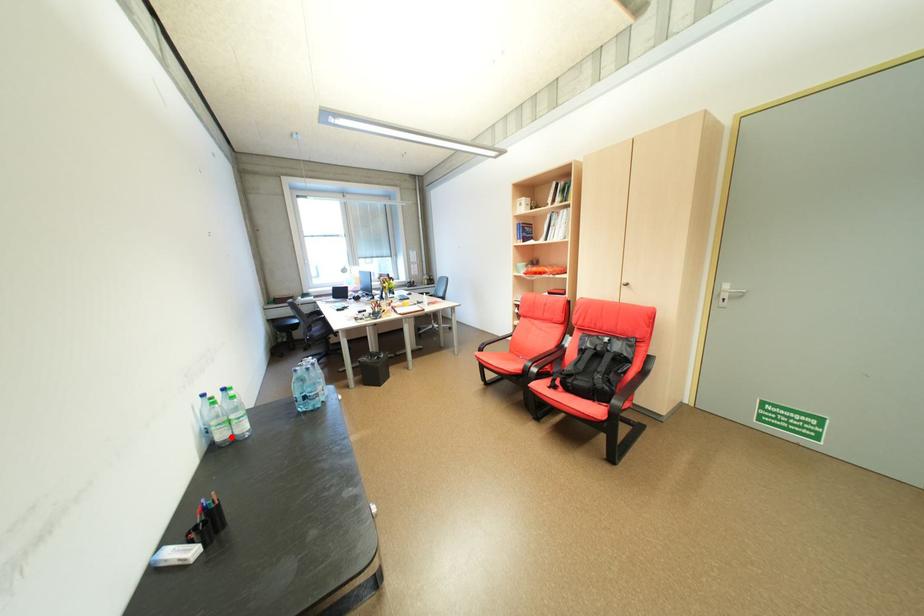
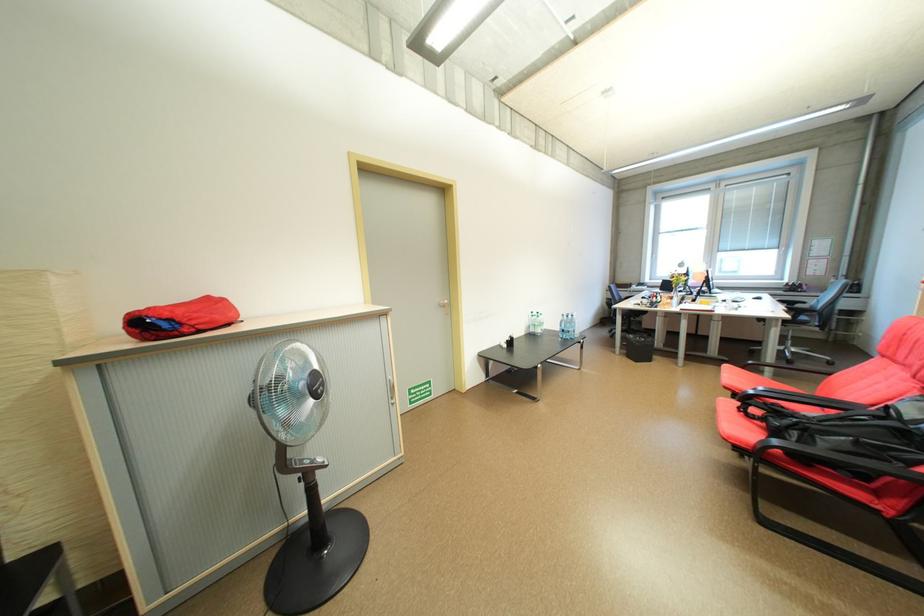
Question: I am providing you with two images of the same scene from different viewpoints. Given a red point in image1, look at the same physical point in image2. Is it:

Choices:
 (A) Closer to the viewpoint
 (B) Farther from the viewpoint

Answer: (B)